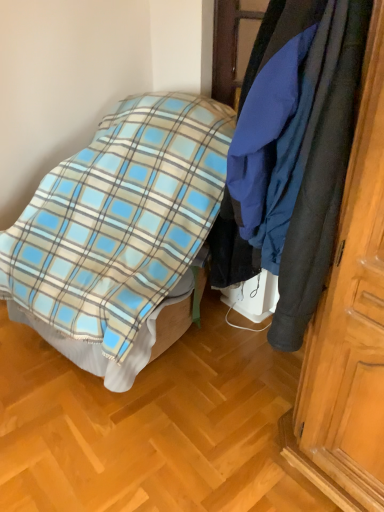
Question: Choose the correct answer: Is dark blue fabric coat at right inside plaid fabric bed at center or outside it?

Choices:
 (A) outside
 (B) inside

Answer: (A)

Question: Is point (307, 83) closer or farther from the camera than point (9, 249)?

Choices:
 (A) closer
 (B) farther

Answer: (A)

Question: From a real-world perspective, relative to plaid fabric bed at center, is dark blue fabric coat at right vertically above or below?

Choices:
 (A) below
 (B) above

Answer: (B)

Question: In the image, is plaid fabric bed at center positioned in front of or behind dark blue fabric coat at right?

Choices:
 (A) behind
 (B) front

Answer: (A)

Question: From their relative heights in the image, would you say plaid fabric bed at center is taller or shorter than dark blue fabric coat at right?

Choices:
 (A) tall
 (B) short

Answer: (A)

Question: Is plaid fabric bed at center situated inside dark blue fabric coat at right or outside?

Choices:
 (A) outside
 (B) inside

Answer: (A)

Question: From a real-world perspective, is plaid fabric bed at center above or below dark blue fabric coat at right?

Choices:
 (A) above
 (B) below

Answer: (B)